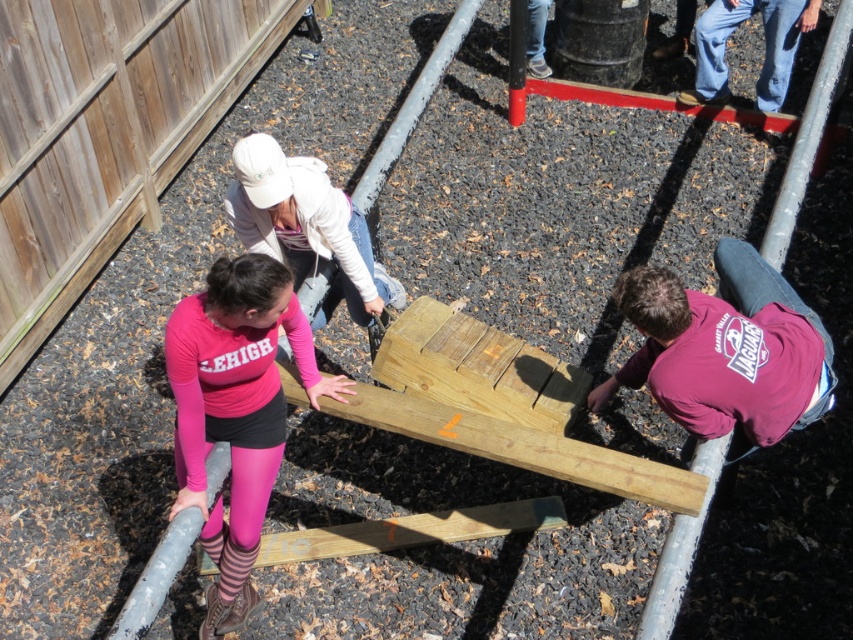
Question: Which object is closer to the camera taking this photo?

Choices:
 (A) white matte jacket at upper center
 (B) maroon jersey at lower right
 (C) pink matte leggings at lower left
 (D) wooden plank at center

Answer: (C)

Question: Can you confirm if maroon jersey at lower right is positioned to the left of wooden plank at center?

Choices:
 (A) no
 (B) yes

Answer: (A)

Question: Is white matte jacket at upper center smaller than wooden plank at center?

Choices:
 (A) no
 (B) yes

Answer: (A)

Question: Which point appears farthest from the camera in this image?

Choices:
 (A) (643, 307)
 (B) (302, 184)

Answer: (B)

Question: Does pink matte leggings at lower left appear over white matte jacket at upper center?

Choices:
 (A) no
 (B) yes

Answer: (A)

Question: Which of the following is the closest to the observer?

Choices:
 (A) (752, 378)
 (B) (335, 218)
 (C) (805, 10)
 (D) (209, 432)

Answer: (A)